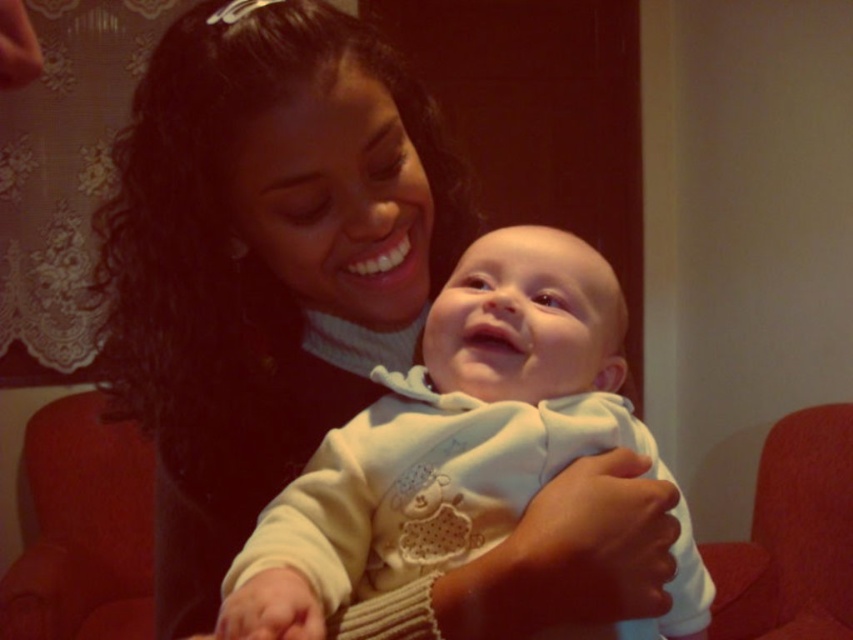
Does white soft fabric baby at center appear on the left side of red fabric armchair at lower right?

Correct, you'll find white soft fabric baby at center to the left of red fabric armchair at lower right.

Does white soft fabric baby at center have a greater width compared to red fabric armchair at lower right?

Incorrect, white soft fabric baby at center's width does not surpass red fabric armchair at lower right's.

In order to click on white soft fabric baby at center in this screenshot , I will do `click(448, 436)`.